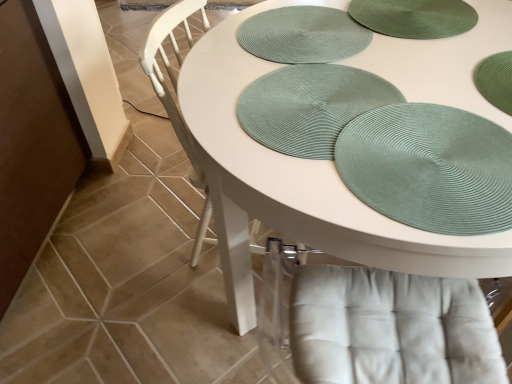
You are a GUI agent. You are given a task and a screenshot of the screen. Output one action in this format:
    pyautogui.click(x=<x>, y=<y>)
    Task: Click on the free spot behind green woven placemat at center, placed as the first platter when sorted from front to back
    
    Given the screenshot: What is the action you would take?
    pyautogui.click(x=303, y=44)